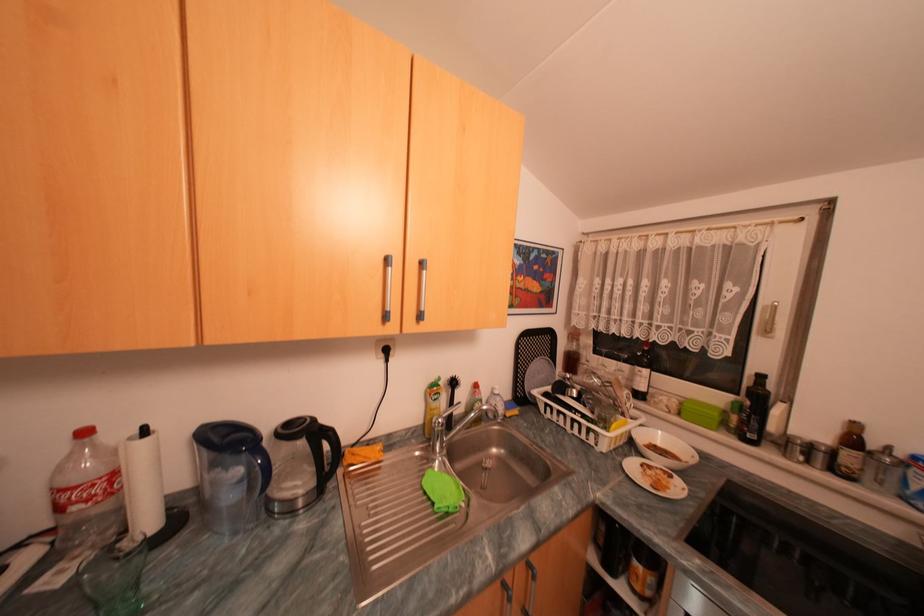
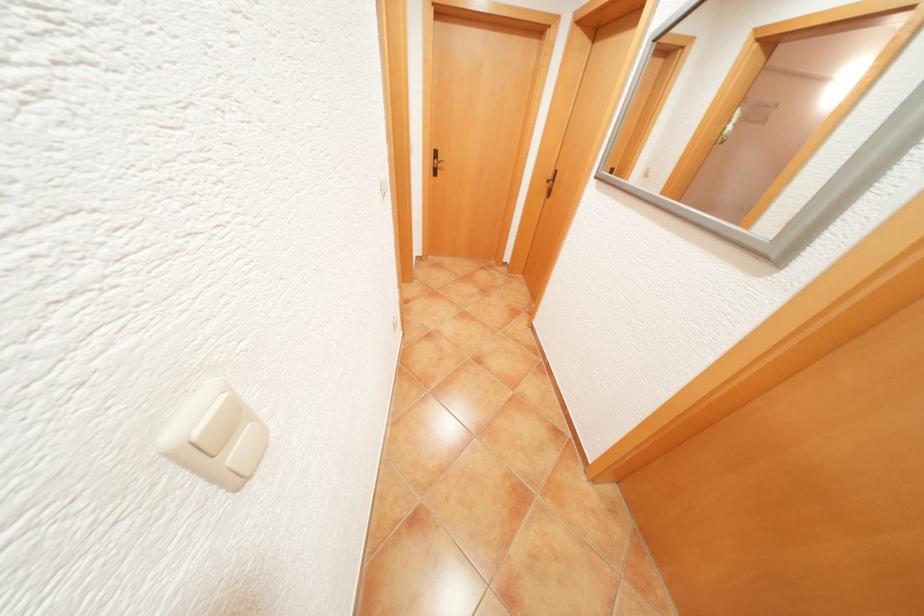
Question: I am providing you with two images of the same scene from different viewpoints. After the viewpoint changes to image2, which objects are now occluded?

Choices:
 (A) light switch rocker
 (B) blue pitcher handle
 (C) black door handle
 (D) grey beanbag

Answer: (B)